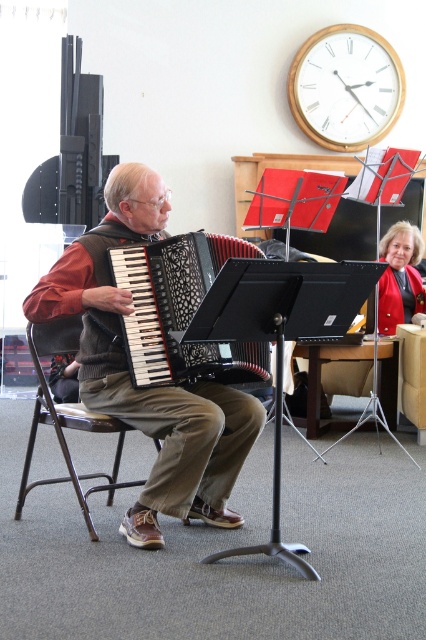
Question: Does black matte accordion at center appear over velvet red jacket at upper right?

Choices:
 (A) no
 (B) yes

Answer: (A)

Question: Which object is farther from the camera taking this photo?

Choices:
 (A) black matte accordion at center
 (B) matte black accordion at center
 (C) metallic silver chair at left

Answer: (C)

Question: Observing the image, what is the correct spatial positioning of matte black accordion at center in reference to black matte accordion at center?

Choices:
 (A) above
 (B) below

Answer: (B)

Question: Is matte black accordion at center further to camera compared to metallic silver chair at left?

Choices:
 (A) yes
 (B) no

Answer: (B)

Question: Which point appears farthest from the camera in this image?

Choices:
 (A) (209, 256)
 (B) (31, 484)
 (C) (394, 314)
 (D) (259, 428)

Answer: (C)

Question: Estimate the real-world distances between objects in this image. Which object is closer to the matte black accordion at center?

Choices:
 (A) metallic silver chair at left
 (B) black matte accordion at center

Answer: (B)